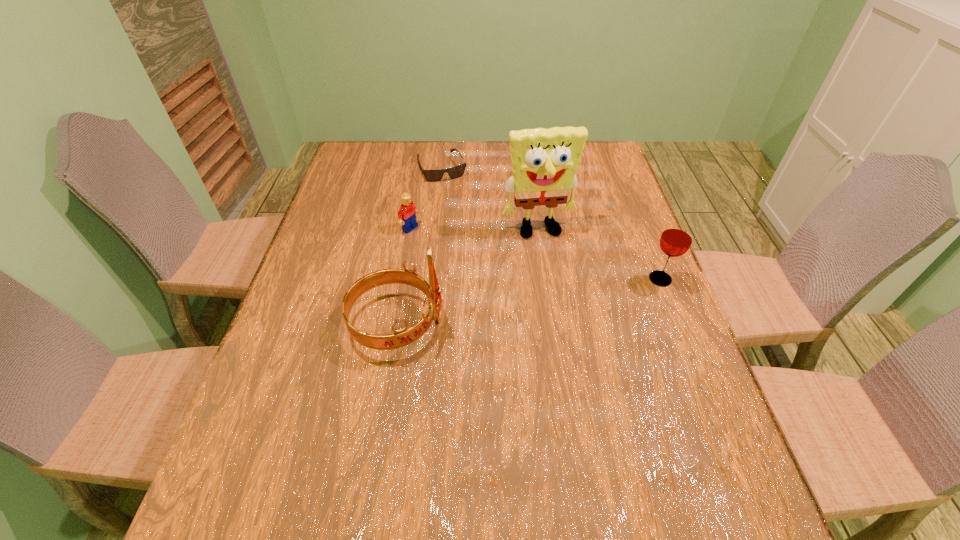
At what (x,y) coordinates should I click in order to perform the action: click on free space on the desktop that is between the nearest object and the rightmost object and is positioned on the face of the tallest object. Please return your answer as a coordinate pair (x, y). This screenshot has height=540, width=960. Looking at the image, I should click on 560,296.

The height and width of the screenshot is (540, 960). I want to click on vacant space on the desktop that is between the tiara and the fourth farthest object and is positioned on the front-facing side of the shortest object, so click(x=503, y=306).

Where is `free space on the desktop that is between the tiara and the rightmost object and is positioned on the front-facing side of the Lego`? The height and width of the screenshot is (540, 960). free space on the desktop that is between the tiara and the rightmost object and is positioned on the front-facing side of the Lego is located at coordinates click(539, 300).